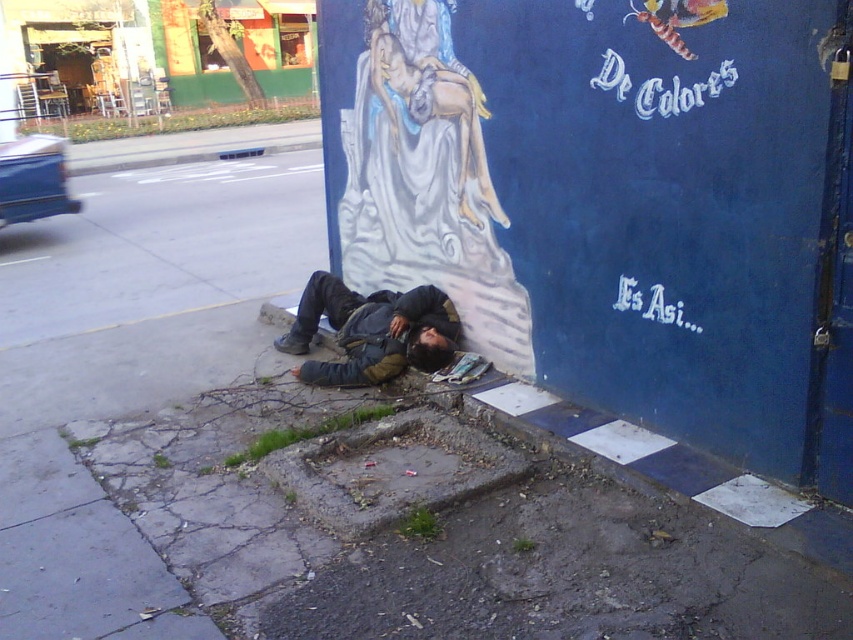
Between smooth concrete curb at lower center and dark gray jacket at lower center, which one appears on the right side from the viewer's perspective?

From the viewer's perspective, smooth concrete curb at lower center appears more on the right side.

Based on the photo, can you confirm if smooth concrete curb at lower center is taller than dark gray jacket at lower center?

No.

Identify the location of smooth concrete curb at lower center. The height and width of the screenshot is (640, 853). (670, 468).

Identify the location of smooth concrete curb at lower center. This screenshot has width=853, height=640. (670, 468).